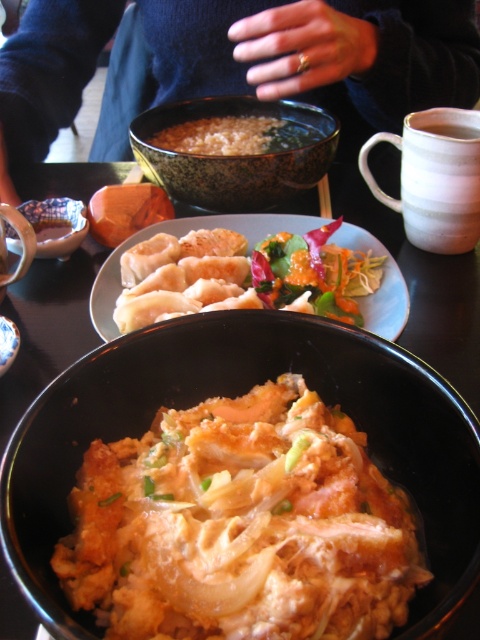
Does golden fried rice at center have a lesser height compared to shiny orange salad at center?

No.

Identify the location of golden fried rice at center. (240, 525).

Which is in front, point (148, 476) or point (382, 257)?

Point (148, 476)

At what (x,y) coordinates should I click in order to perform the action: click on golden fried rice at center. Please return your answer as a coordinate pair (x, y). Image resolution: width=480 pixels, height=640 pixels. Looking at the image, I should click on (240, 525).

Is golden fried rice at center to the left of porcelain bowl at lower left from the viewer's perspective?

Incorrect, golden fried rice at center is not on the left side of porcelain bowl at lower left.

Is the position of golden fried rice at center more distant than that of porcelain bowl at lower left?

No, golden fried rice at center is in front of porcelain bowl at lower left.

You are a GUI agent. You are given a task and a screenshot of the screen. Output one action in this format:
    pyautogui.click(x=<x>, y=<y>)
    Task: Click on the golden fried rice at center
    This screenshot has height=640, width=480.
    Given the screenshot: What is the action you would take?
    pyautogui.click(x=240, y=525)

Find the location of a particular element. golden fried rice at center is located at coordinates (240, 525).

Who is taller, golden brown dumplings at center or porcelain bowl at lower left?

With more height is golden brown dumplings at center.

The image size is (480, 640). In order to click on golden brown dumplings at center in this screenshot , I will do `click(241, 275)`.